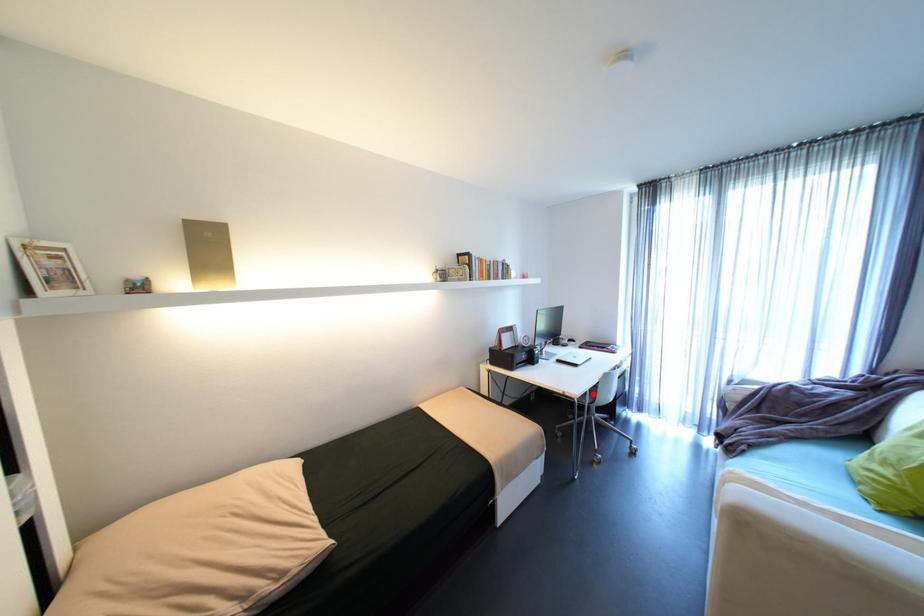
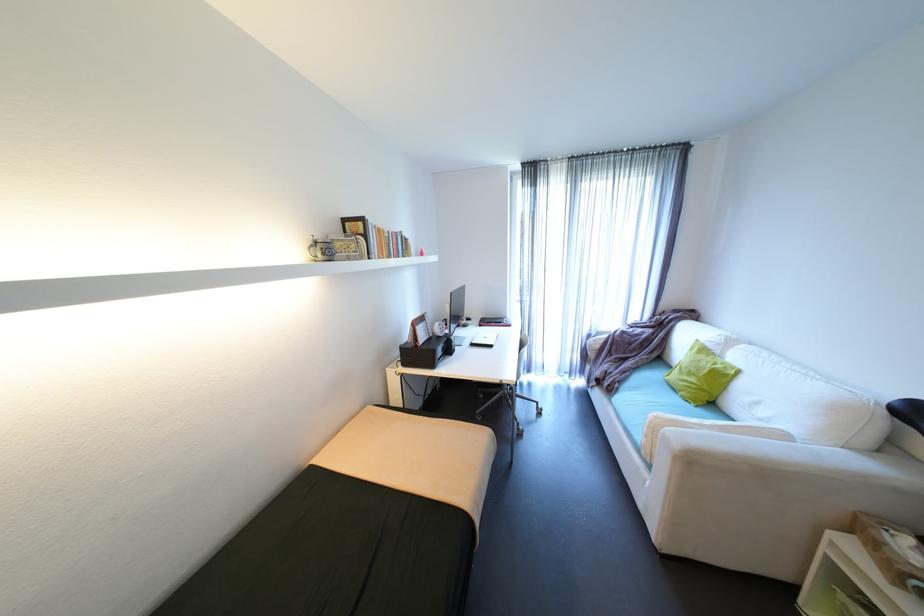
Question: I am providing you with two images of the same scene from different viewpoints. A red point is marked on the first image. Is the red point's position out of view in image 2?

Choices:
 (A) Yes
 (B) No

Answer: (A)